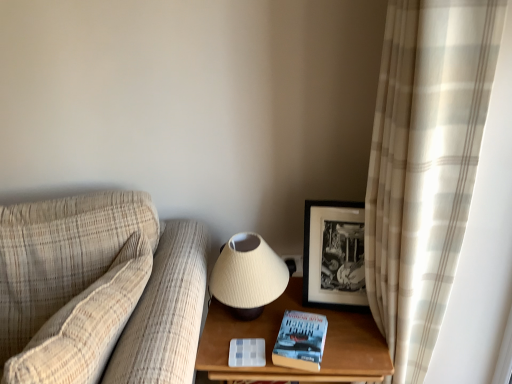
Question: Is point (303, 352) positioned closer to the camera than point (241, 297)?

Choices:
 (A) closer
 (B) farther

Answer: (A)

Question: From a real-world perspective, relative to matte cream lampshade at center, is hardcover blue book at lower right vertically above or below?

Choices:
 (A) below
 (B) above

Answer: (A)

Question: Based on their relative distances, which object is nearer to the black matte picture frame at upper right?

Choices:
 (A) wooden table at lower right
 (B) plaid fabric couch at left
 (C) hardcover blue book at lower right
 (D) beige plaid curtain at right
 (E) matte cream lampshade at center

Answer: (A)

Question: Which is nearer to the plaid fabric couch at left?

Choices:
 (A) beige plaid curtain at right
 (B) wooden table at lower right
 (C) black matte picture frame at upper right
 (D) matte cream lampshade at center
 (E) hardcover blue book at lower right

Answer: (D)